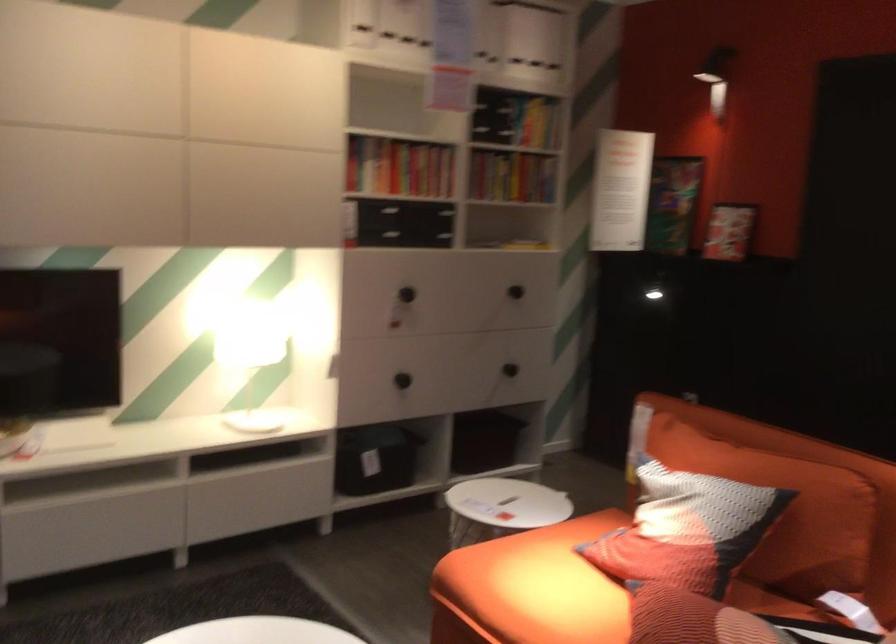
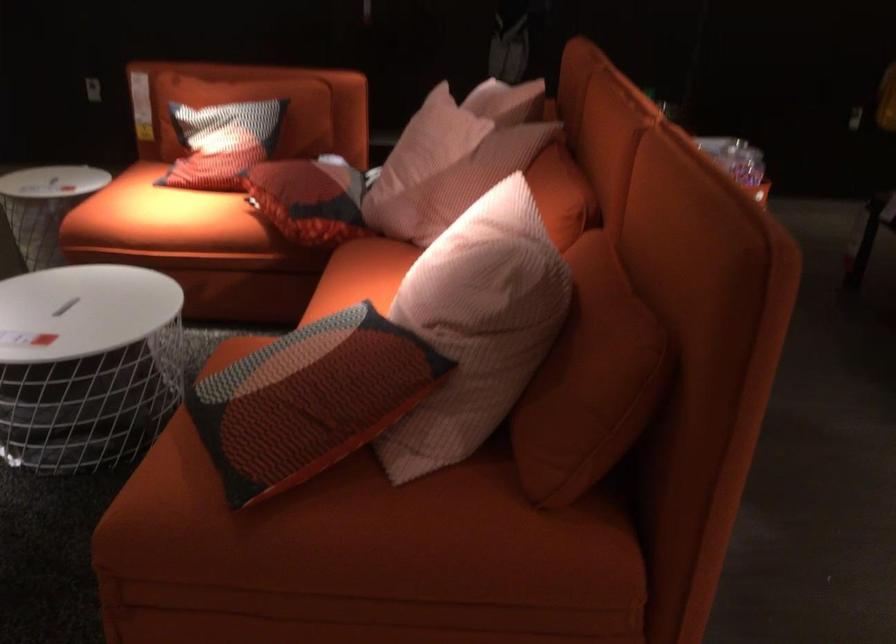
The point at (668, 522) is marked in the first image. Where is the corresponding point in the second image?

(222, 142)